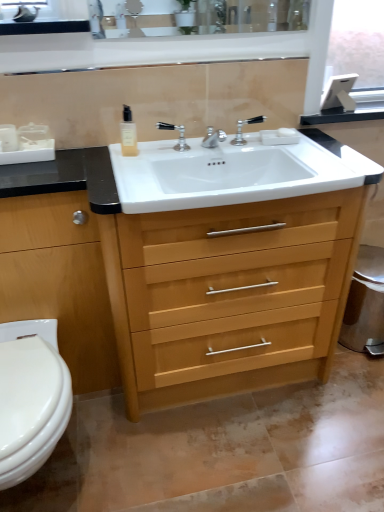
Question: From their relative heights in the image, would you say white matte soap at upper center is taller or shorter than polished chrome faucet at center, the first tap in the left-to-right sequence?

Choices:
 (A) short
 (B) tall

Answer: (A)

Question: From a real-world perspective, is white matte soap at upper center positioned above or below polished chrome faucet at center, the second tap positioned from the right?

Choices:
 (A) above
 (B) below

Answer: (B)

Question: Based on their relative distances, which object is farther from the white matte soap at upper center?

Choices:
 (A) polished chrome faucet at center, the first tap in the left-to-right sequence
 (B) clear glass soap dispenser at upper center
 (C) light wood/finish chest of drawers at left
 (D) white plastic container at left
 (E) light wood/wooden vanity at center

Answer: (C)

Question: Estimate the real-world distances between objects in this image. Which object is farther from the light wood/finish chest of drawers at left?

Choices:
 (A) light wood/wooden vanity at center
 (B) white glossy sink at center
 (C) polished chrome faucet at center, the first tap in the left-to-right sequence
 (D) clear glass soap dispenser at upper center
 (E) white plastic container at left

Answer: (C)